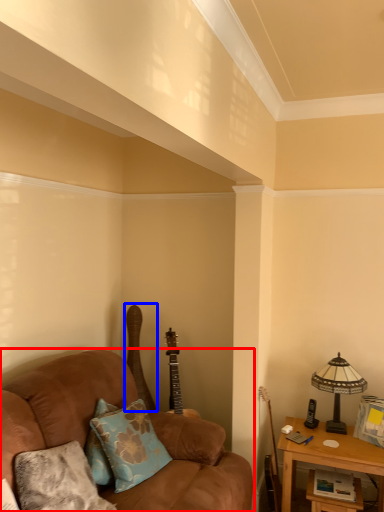
Question: Which object appears farthest to the camera in this image, studio couch (highlighted by a red box) or guitar (highlighted by a blue box)?

Choices:
 (A) studio couch
 (B) guitar

Answer: (B)